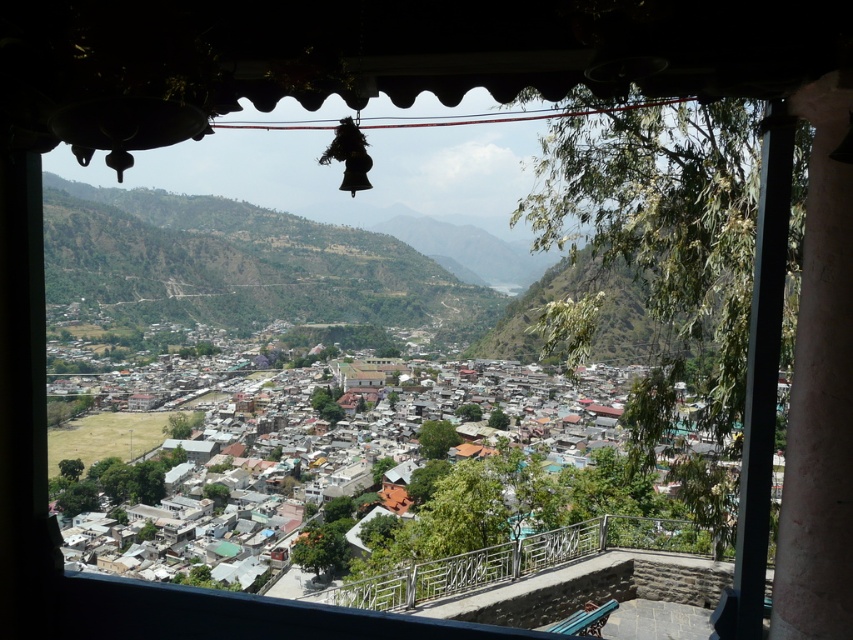
Is rustic wooden houses at center to the left of metallic railing at lower center from the viewer's perspective?

Correct, you'll find rustic wooden houses at center to the left of metallic railing at lower center.

Which is more to the right, rustic wooden houses at center or metallic railing at lower center?

metallic railing at lower center

Which is in front, point (236, 499) or point (558, 541)?

Point (558, 541) is more forward.

Where is `rustic wooden houses at center`? This screenshot has width=853, height=640. rustic wooden houses at center is located at coordinates (531, 516).